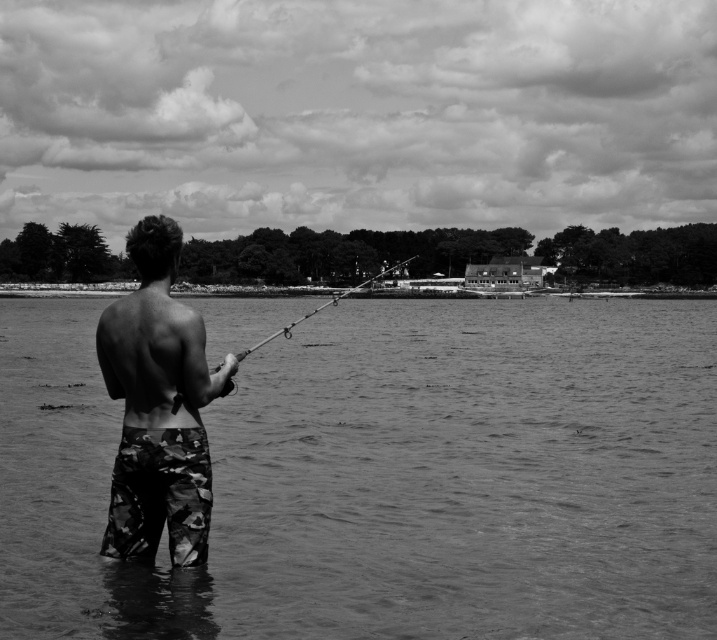
You are navigating a small boat in the water and see two points marked on your map. The first point is at coordinate point (14, 545) and the second is at point (108, 362). Which point is farther away from your current position if you are facing the direction the person is facing?

Point (14, 545) is behind point (108, 362), so if you are facing the direction the person is facing, point (14, 545) would be farther away from your current position.